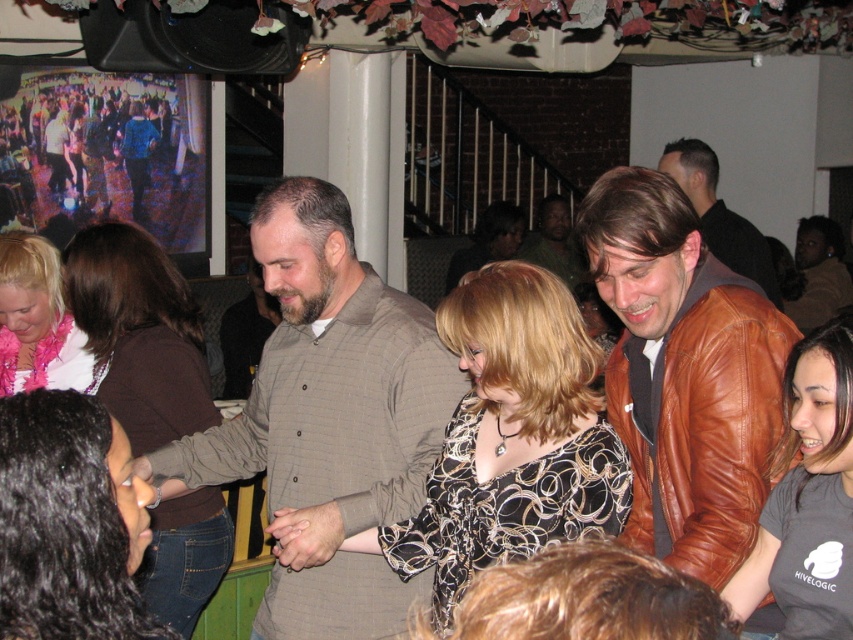
Is brown fabric shirt at left shorter than matte pink scarf at lower left?

No.

Looking at this image, does brown fabric shirt at left have a smaller size compared to matte pink scarf at lower left?

No.

Is point (219, 529) more distant than point (38, 276)?

No, (219, 529) is in front of (38, 276).

This screenshot has height=640, width=853. In order to click on brown fabric shirt at left in this screenshot , I will do `click(138, 333)`.

Between brown leather jacket at right and black hair at lower left, which one is positioned higher?

Positioned higher is brown leather jacket at right.

Is point (704, 497) closer to camera compared to point (42, 451)?

No, (704, 497) is behind (42, 451).

Identify the location of brown leather jacket at right. (683, 372).

Is point (671, 148) closer to camera compared to point (582, 262)?

Yes, point (671, 148) is closer to viewer.

Does point (761, 273) come behind point (556, 225)?

No, it is in front of (556, 225).

At what (x,y) coordinates should I click in order to perform the action: click on brown leather jacket at upper right. Please return your answer as a coordinate pair (x, y). This screenshot has height=640, width=853. Looking at the image, I should click on [718, 214].